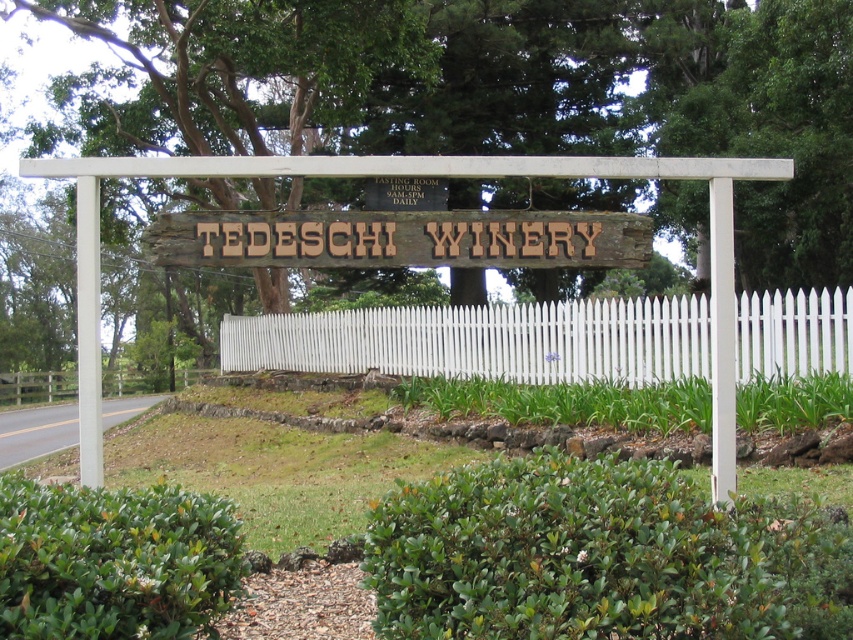
Does green leafy hedge at lower center appear under white picket fence at left?

Incorrect, green leafy hedge at lower center is not positioned below white picket fence at left.

Who is positioned more to the left, green leafy hedge at lower center or white picket fence at left?

From the viewer's perspective, white picket fence at left appears more on the left side.

You are a GUI agent. You are given a task and a screenshot of the screen. Output one action in this format:
    pyautogui.click(x=<x>, y=<y>)
    Task: Click on the green leafy hedge at lower center
    
    Given the screenshot: What is the action you would take?
    pyautogui.click(x=113, y=561)

Is green leafy bush at center bigger than wooden sign at center?

Actually, green leafy bush at center might be smaller than wooden sign at center.

Is point (515, 518) closer to camera compared to point (267, 221)?

Yes, it is.

Locate an element on the screen. green leafy bush at center is located at coordinates (601, 556).

Identify the location of green leafy bush at center. This screenshot has width=853, height=640. (601, 556).

Does green leafy bush at center come in front of green leafy hedge at lower center?

Yes, it is.

Is green leafy bush at center below green leafy hedge at lower center?

Yes, green leafy bush at center is below green leafy hedge at lower center.

Where is `green leafy bush at center`? green leafy bush at center is located at coordinates (601, 556).

You are a GUI agent. You are given a task and a screenshot of the screen. Output one action in this format:
    pyautogui.click(x=<x>, y=<y>)
    Task: Click on the green leafy bush at center
    This screenshot has width=853, height=640.
    Given the screenshot: What is the action you would take?
    pyautogui.click(x=601, y=556)